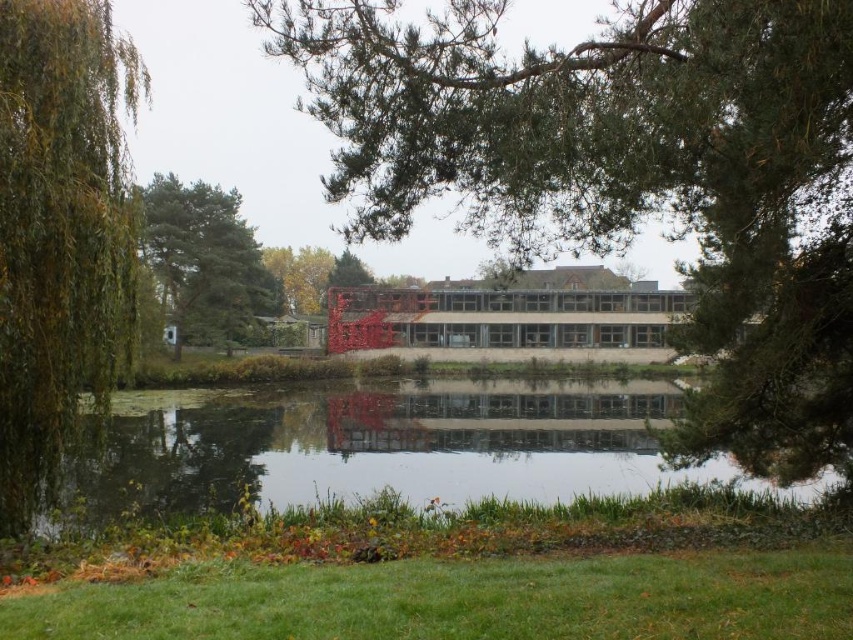
Question: Observing the image, what is the correct spatial positioning of transparent glass water at center in reference to green leafy tree at left?

Choices:
 (A) above
 (B) below

Answer: (B)

Question: Does transparent glass water at center appear over green grass at lower center?

Choices:
 (A) yes
 (B) no

Answer: (B)

Question: Can you confirm if green leafy tree at left is smaller than green textured pine tree at upper left?

Choices:
 (A) yes
 (B) no

Answer: (A)

Question: Which point appears farthest from the camera in this image?

Choices:
 (A) (76, 324)
 (B) (161, 209)

Answer: (B)

Question: Considering the real-world distances, which object is closest to the green textured pine tree at upper left?

Choices:
 (A) green grass at lower center
 (B) green leafy tree at left

Answer: (B)

Question: Which of the following is the closest to the observer?

Choices:
 (A) [618, 218]
 (B) [251, 305]

Answer: (A)